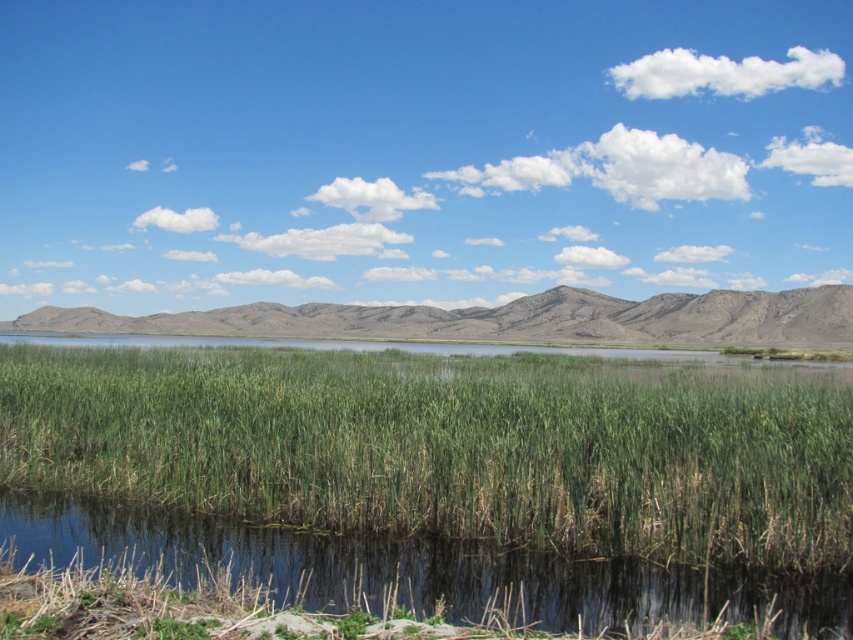
Which is more to the right, green grassy pond at lower center or gray/dry grassy at center?

green grassy pond at lower center is more to the right.

Does green grassy pond at lower center lie behind gray/dry grassy at center?

No, green grassy pond at lower center is in front of gray/dry grassy at center.

Which is behind, point (444, 589) or point (554, 300)?

The point (554, 300) is more distant.

I want to click on green grassy pond at lower center, so click(x=413, y=570).

Is green grass at lower center closer to camera compared to gray/dry grassy at center?

Yes, green grass at lower center is in front of gray/dry grassy at center.

Between point (227, 413) and point (303, 316), which one is positioned behind?

The point (303, 316) is more distant.

Where is `green grass at lower center`? This screenshot has width=853, height=640. green grass at lower center is located at coordinates (445, 448).

Can you confirm if green grass at lower center is positioned above green grassy pond at lower center?

Yes.

From the picture: Does green grass at lower center have a greater width compared to green grassy pond at lower center?

Yes.

Which is behind, point (291, 467) or point (432, 561)?

The point (291, 467) is more distant.

Where is `green grass at lower center`? The width and height of the screenshot is (853, 640). green grass at lower center is located at coordinates (445, 448).